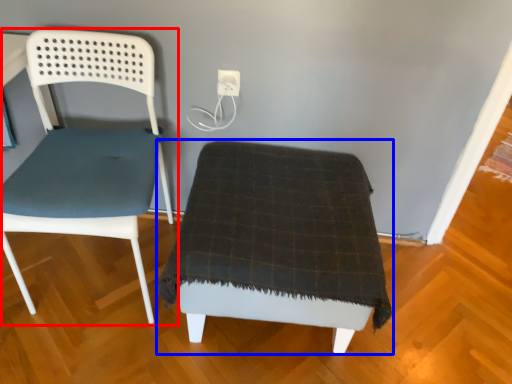
Question: Which point is further to the camera, chair (highlighted by a red box) or furniture (highlighted by a blue box)?

Choices:
 (A) chair
 (B) furniture

Answer: (B)